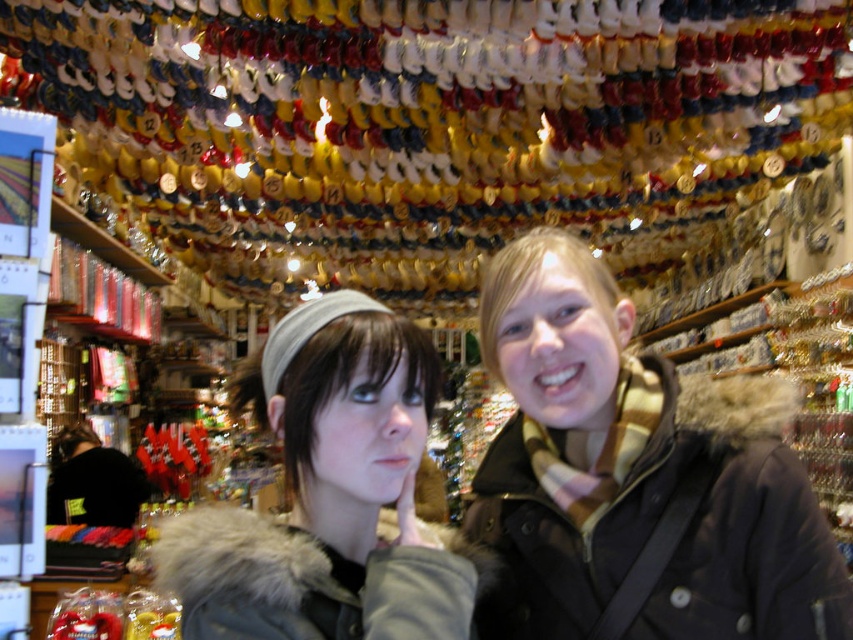
Does point (277, 636) come closer to viewer compared to point (126, 508)?

That is True.

Between matte gray headband at center and black fuzzy jacket at lower left, which one has less height?

matte gray headband at center is shorter.

Does point (383, 412) come farther from viewer compared to point (107, 513)?

No, it is in front of (107, 513).

Image resolution: width=853 pixels, height=640 pixels. Find the location of `matte gray headband at center`. matte gray headband at center is located at coordinates (328, 493).

Which of these two, green fur-lined coat at center or black fuzzy jacket at lower left, stands taller?

Standing taller between the two is green fur-lined coat at center.

Does green fur-lined coat at center have a larger size compared to black fuzzy jacket at lower left?

Yes.

The width and height of the screenshot is (853, 640). I want to click on green fur-lined coat at center, so click(634, 477).

Identify the location of green fur-lined coat at center. (634, 477).

Who is lower down, green fur-lined coat at center or matte gray headband at center?

Positioned lower is green fur-lined coat at center.

Who is positioned more to the right, green fur-lined coat at center or matte gray headband at center?

green fur-lined coat at center is more to the right.

Describe the element at coordinates (634, 477) in the screenshot. The width and height of the screenshot is (853, 640). I see `green fur-lined coat at center` at that location.

The image size is (853, 640). Identify the location of green fur-lined coat at center. pyautogui.click(x=634, y=477).